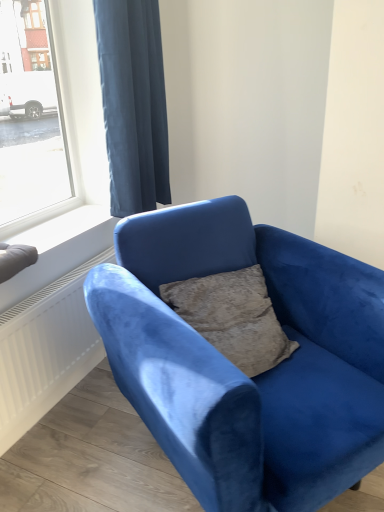
Question: Is velvet blue couch at center to the right of white smooth window sill at lower left from the viewer's perspective?

Choices:
 (A) yes
 (B) no

Answer: (A)

Question: Is velvet blue couch at center positioned behind white smooth window sill at lower left?

Choices:
 (A) no
 (B) yes

Answer: (A)

Question: Is velvet blue couch at center in contact with white smooth window sill at lower left?

Choices:
 (A) no
 (B) yes

Answer: (A)

Question: Is white smooth window sill at lower left a part of velvet blue couch at center?

Choices:
 (A) no
 (B) yes

Answer: (A)

Question: Would you say velvet blue couch at center is a long distance from white smooth window sill at lower left?

Choices:
 (A) yes
 (B) no

Answer: (B)

Question: Is point coord(84,209) positioned closer to the camera than point coord(296,301)?

Choices:
 (A) farther
 (B) closer

Answer: (A)

Question: From a real-world perspective, relative to velvet blue couch at center, is white smooth window sill at lower left vertically above or below?

Choices:
 (A) above
 (B) below

Answer: (A)

Question: From the image's perspective, is white smooth window sill at lower left located above or below velvet blue couch at center?

Choices:
 (A) below
 (B) above

Answer: (B)

Question: Based on their positions, is white smooth window sill at lower left located to the left or right of velvet blue couch at center?

Choices:
 (A) left
 (B) right

Answer: (A)

Question: Is white smooth window sill at lower left inside the boundaries of dark blue fabric curtain at upper left, or outside?

Choices:
 (A) inside
 (B) outside

Answer: (B)

Question: From a real-world perspective, relative to dark blue fabric curtain at upper left, is white smooth window sill at lower left vertically above or below?

Choices:
 (A) above
 (B) below

Answer: (B)

Question: Is white smooth window sill at lower left in front of or behind dark blue fabric curtain at upper left in the image?

Choices:
 (A) behind
 (B) front

Answer: (A)

Question: Is white smooth window sill at lower left taller or shorter than dark blue fabric curtain at upper left?

Choices:
 (A) short
 (B) tall

Answer: (A)

Question: From a real-world perspective, is velvet blue couch at center positioned above or below dark blue fabric curtain at upper left?

Choices:
 (A) below
 (B) above

Answer: (A)

Question: Is velvet blue couch at center spatially inside dark blue fabric curtain at upper left, or outside of it?

Choices:
 (A) inside
 (B) outside

Answer: (B)